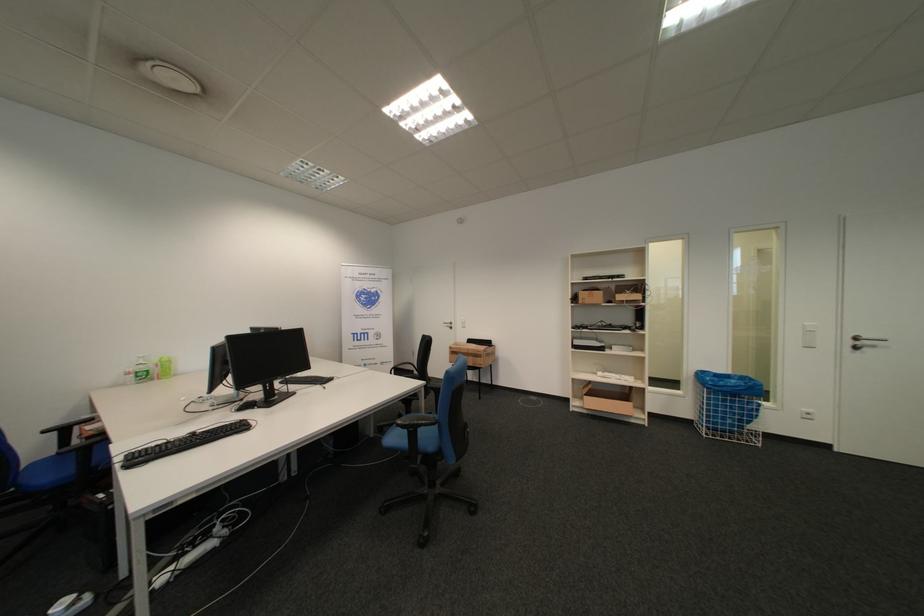
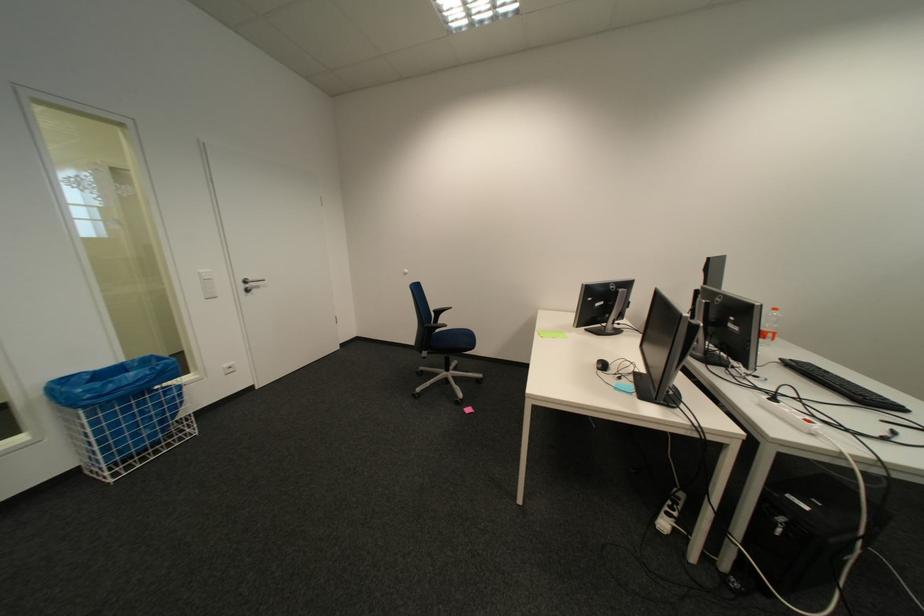
Where in the second image is the point corresponding to pixel 862 344 from the first image?

(254, 286)